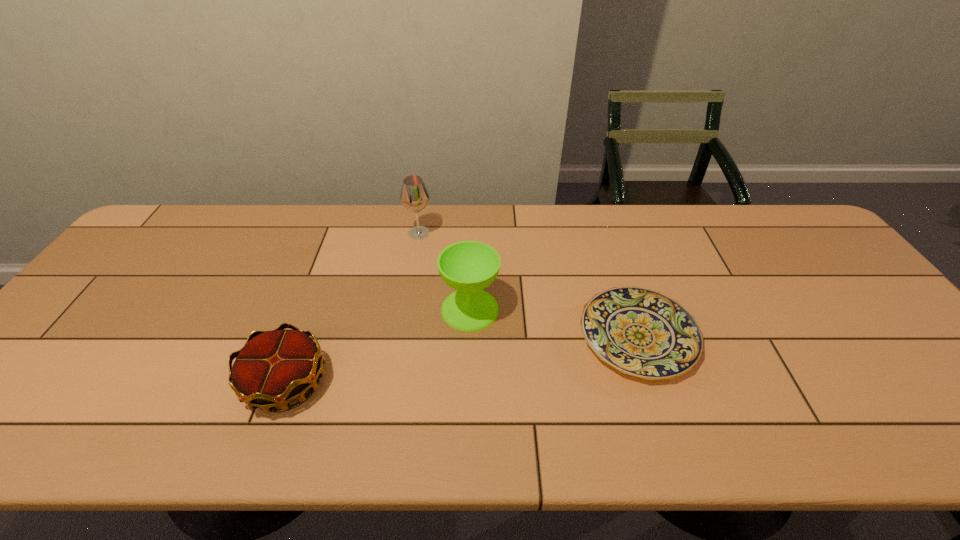
Where is `free space between the leftmost object and the rightmost object`? This screenshot has height=540, width=960. free space between the leftmost object and the rightmost object is located at coordinates (462, 359).

I want to click on empty location between the crown and the plate, so click(462, 359).

The image size is (960, 540). Find the location of `vacant area that lies between the third tallest object and the right wineglass`. vacant area that lies between the third tallest object and the right wineglass is located at coordinates (378, 346).

The width and height of the screenshot is (960, 540). Find the location of `free point between the third object from left to right and the shortest object`. free point between the third object from left to right and the shortest object is located at coordinates (554, 323).

The width and height of the screenshot is (960, 540). I want to click on vacant space in between the shortest object and the right wineglass, so click(x=554, y=323).

Find the location of a particular element. free space between the third tallest object and the farthest object is located at coordinates (352, 308).

Where is `free spot between the nearer wineglass and the shortest object`? The image size is (960, 540). free spot between the nearer wineglass and the shortest object is located at coordinates (554, 323).

At what (x,y) coordinates should I click in order to perform the action: click on free space between the leftmost object and the rightmost object. Please return your answer as a coordinate pair (x, y). Looking at the image, I should click on (462, 359).

Identify the location of free point between the nearer wineglass and the crown. The height and width of the screenshot is (540, 960). (378, 346).

This screenshot has height=540, width=960. In order to click on free space between the rightmost object and the nearer wineglass in this screenshot , I will do click(554, 323).